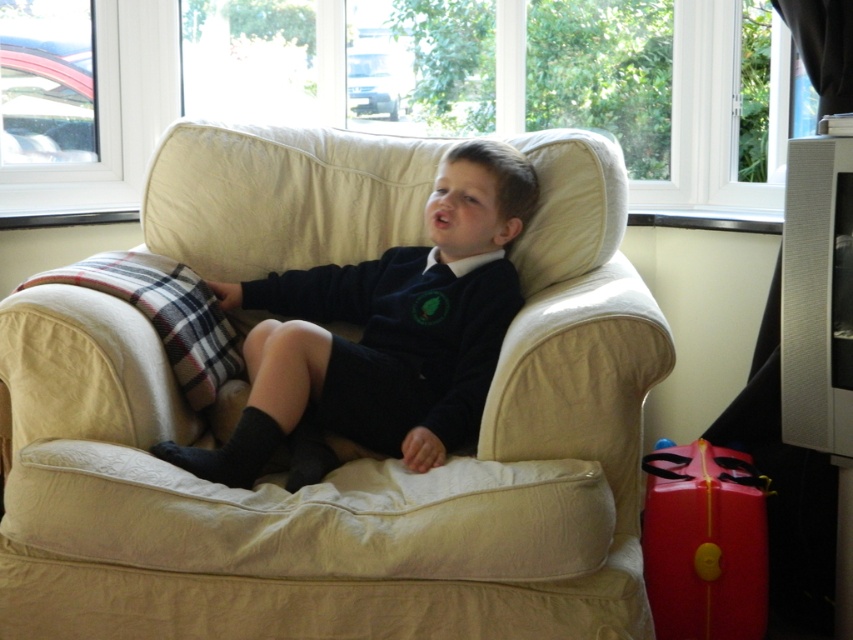
Question: Does matte black sweater at center lie behind rubberized red suitcase at lower right?

Choices:
 (A) no
 (B) yes

Answer: (A)

Question: Among these points, which one is farthest from the camera?

Choices:
 (A) 703,467
 (B) 398,417
 (C) 370,220
 (D) 407,428

Answer: (C)

Question: Can you confirm if matte black sweater at center is thinner than dark blue jersey at center?

Choices:
 (A) no
 (B) yes

Answer: (A)

Question: Which object is the farthest from the matte black sweater at center?

Choices:
 (A) rubberized red suitcase at lower right
 (B) dark blue jersey at center

Answer: (A)

Question: Does beige fabric armchair at center have a smaller size compared to rubberized red suitcase at lower right?

Choices:
 (A) no
 (B) yes

Answer: (A)

Question: Which of the following is the farthest from the observer?

Choices:
 (A) (730, 602)
 (B) (483, 291)
 (C) (482, 308)
 (D) (593, 483)

Answer: (B)